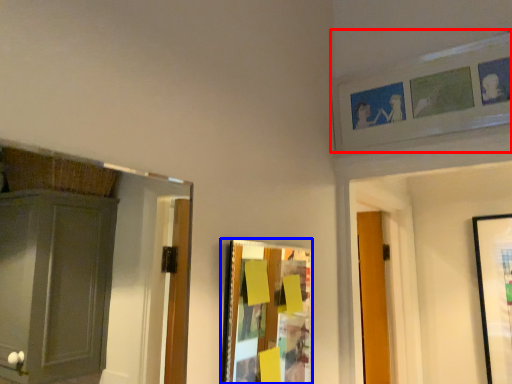
Question: Among these objects, which one is farthest to the camera, picture frame (highlighted by a red box) or picture frame (highlighted by a blue box)?

Choices:
 (A) picture frame
 (B) picture frame

Answer: (A)